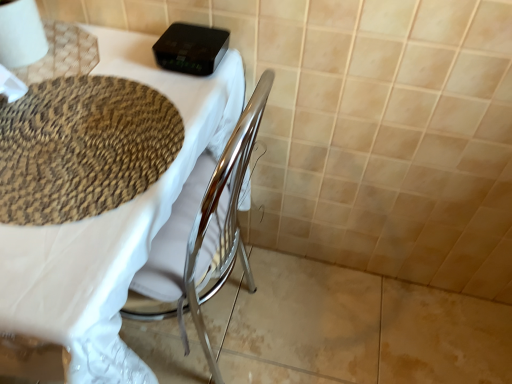
Measure the distance between point [71,109] and camera.

Point [71,109] and camera are 29.80 inches apart from each other.

The width and height of the screenshot is (512, 384). Find the location of `woven beige mat at upper left`. woven beige mat at upper left is located at coordinates (82, 148).

Which point is more distant from viewer, (32, 49) or (99, 101)?

The point (32, 49) is farther.

In the scene shown: Considering the positions of objects white paper at upper left and woven beige mat at upper left in the image provided, who is in front, white paper at upper left or woven beige mat at upper left?

Positioned in front is woven beige mat at upper left.

In terms of height, does white paper at upper left look taller or shorter compared to woven beige mat at upper left?

white paper at upper left is taller than woven beige mat at upper left.

Which is correct: white paper at upper left is inside woven beige mat at upper left, or outside of it?

white paper at upper left lies outside woven beige mat at upper left.

Is matte woven placemat at upper left positioned with its back to woven beige mat at upper left?

No, matte woven placemat at upper left is not facing away from woven beige mat at upper left.

From a real-world perspective, is matte woven placemat at upper left positioned above or below woven beige mat at upper left?

Clearly, from a real-world perspective, matte woven placemat at upper left is below woven beige mat at upper left.

Considering the relative positions of matte woven placemat at upper left and woven beige mat at upper left in the image provided, is matte woven placemat at upper left to the left of woven beige mat at upper left from the viewer's perspective?

Yes, matte woven placemat at upper left is to the left of woven beige mat at upper left.

The image size is (512, 384). Find the location of `toilet paper on the right of the matte woven placemat at upper left`. toilet paper on the right of the matte woven placemat at upper left is located at coordinates pos(21,33).

Does white paper at upper left have a smaller size compared to matte woven placemat at upper left?

Indeed, white paper at upper left has a smaller size compared to matte woven placemat at upper left.

Is matte woven placemat at upper left at the back of white paper at upper left?

No, white paper at upper left is not facing away from matte woven placemat at upper left.

From a real-world perspective, is matte woven placemat at upper left positioned above or below white paper at upper left?

From a real-world perspective, matte woven placemat at upper left is physically below white paper at upper left.

Image resolution: width=512 pixels, height=384 pixels. Identify the location of table below the white paper at upper left (from the image's perspective). coord(112,226).

Is matte woven placemat at upper left positioned beyond the bounds of white paper at upper left?

Absolutely, matte woven placemat at upper left is external to white paper at upper left.

Looking at this image, is woven beige mat at upper left located outside white paper at upper left?

Yes.

Is woven beige mat at upper left in contact with white paper at upper left?

No, woven beige mat at upper left is not making contact with white paper at upper left.

Between woven beige mat at upper left and white paper at upper left, which one appears on the right side from the viewer's perspective?

woven beige mat at upper left.

From a real-world perspective, between woven beige mat at upper left and white paper at upper left, who is vertically lower?

In real-world perspective, woven beige mat at upper left is lower.

Considering the relative positions of woven beige mat at upper left and matte woven placemat at upper left in the image provided, is woven beige mat at upper left in front of matte woven placemat at upper left?

That is False.

The height and width of the screenshot is (384, 512). I want to click on table that is under the woven beige mat at upper left (from a real-world perspective), so click(112, 226).

From the image's perspective, between woven beige mat at upper left and matte woven placemat at upper left, who is located below?

matte woven placemat at upper left is shown below in the image.

Considering the positions of points (113, 139) and (4, 262), is point (113, 139) closer to camera compared to point (4, 262)?

That is False.

Locate an element on the screen. The image size is (512, 384). mat below the white paper at upper left (from the image's perspective) is located at coordinates (82, 148).

In order to click on mat that is behind the matte woven placemat at upper left in this screenshot , I will do tap(82, 148).

From the image, which object appears to be farther from matte woven placemat at upper left, woven beige mat at upper left or white paper at upper left?

Among the two, white paper at upper left is located further to matte woven placemat at upper left.

From the image, which object appears to be farther from white paper at upper left, woven beige mat at upper left or matte woven placemat at upper left?

matte woven placemat at upper left.

Looking at the image, which one is located closer to matte woven placemat at upper left, white paper at upper left or woven beige mat at upper left?

Among the two, woven beige mat at upper left is located nearer to matte woven placemat at upper left.

Which object lies nearer to the anchor point woven beige mat at upper left, white paper at upper left or matte woven placemat at upper left?

Among the two, matte woven placemat at upper left is located nearer to woven beige mat at upper left.

Considering their positions, is matte woven placemat at upper left positioned further to woven beige mat at upper left than white paper at upper left?

Among the two, white paper at upper left is located further to woven beige mat at upper left.

Considering their positions, is matte woven placemat at upper left positioned closer to white paper at upper left than woven beige mat at upper left?

woven beige mat at upper left is closer to white paper at upper left.

Find the location of a particular element. The image size is (512, 384). mat between white paper at upper left and matte woven placemat at upper left in the up-down direction is located at coordinates (82, 148).